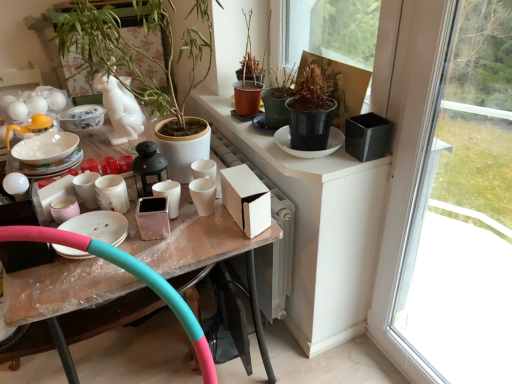
Question: Choose the correct answer: Is matte white teapot at upper left inside green matte plant at upper left, acting as the 2th houseplant starting from the right, or outside it?

Choices:
 (A) outside
 (B) inside

Answer: (A)

Question: Considering the positions of point (71, 160) and point (74, 52), is point (71, 160) closer or farther from the camera than point (74, 52)?

Choices:
 (A) closer
 (B) farther

Answer: (B)

Question: Based on their relative distances, which object is nearer to the pink rubber garden hose at lower left?

Choices:
 (A) white matte cup at center, marked as the 2th tableware in a right-to-left arrangement
 (B) pink rubber hula hoop at lower left
 (C) terracotta pot at upper center, which appears as the second houseplant when viewed from the left
 (D) matte white teapot at upper left
 (E) green matte plant at upper left, acting as the 2th houseplant starting from the right

Answer: (B)

Question: Which object is the closest to the terracotta pot at upper center, which appears as the second houseplant when viewed from the left?

Choices:
 (A) green matte plant at upper left, the 1th houseplant positioned from the left
 (B) matte white teapot at upper left
 (C) transparent glass window at right
 (D) pink rubber garden hose at lower left
 (E) pink rubber hula hoop at lower left

Answer: (A)